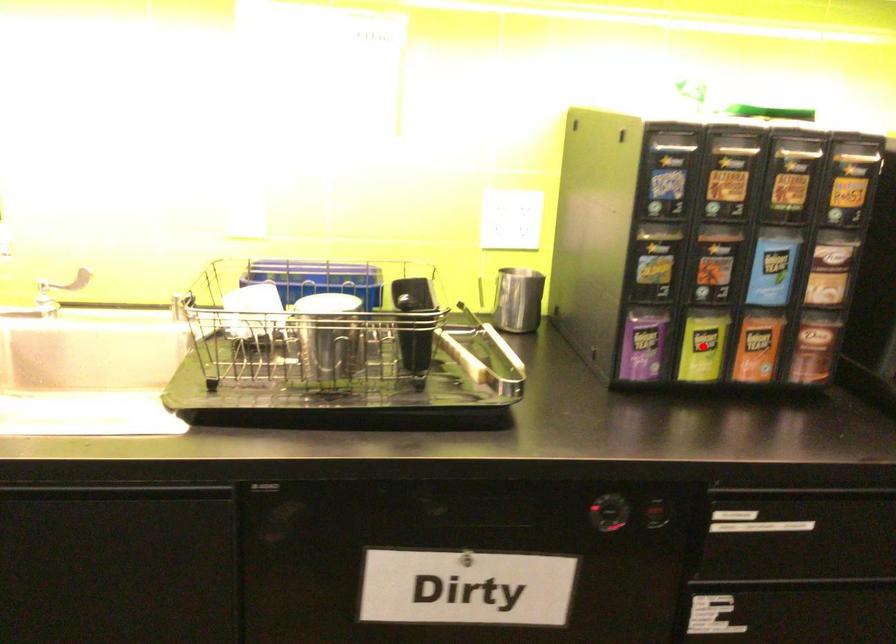
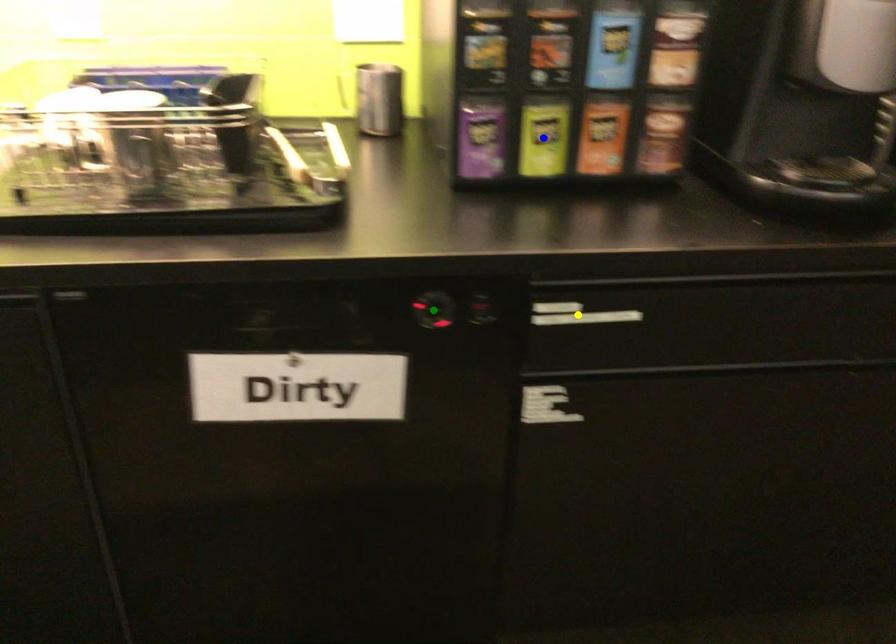
Question: I am providing you with two images of the same scene from different viewpoints. A red point is marked on the first image. You are given multiple points on the second image. In image 2, which mark is for the same physical point as the one in image 1?

Choices:
 (A) green point
 (B) yellow point
 (C) blue point

Answer: (C)